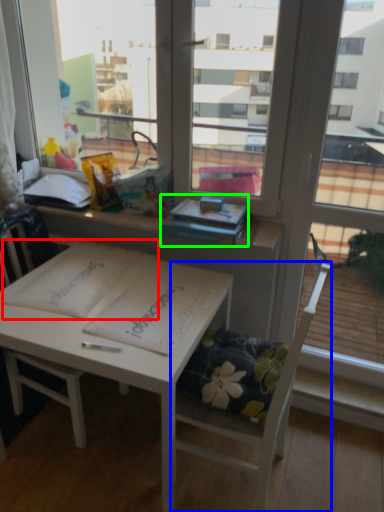
Question: Which object is the closest to the notebook (highlighted by a red box)? Choose among these: chair (highlighted by a blue box) or book (highlighted by a green box).

Choices:
 (A) chair
 (B) book

Answer: (B)